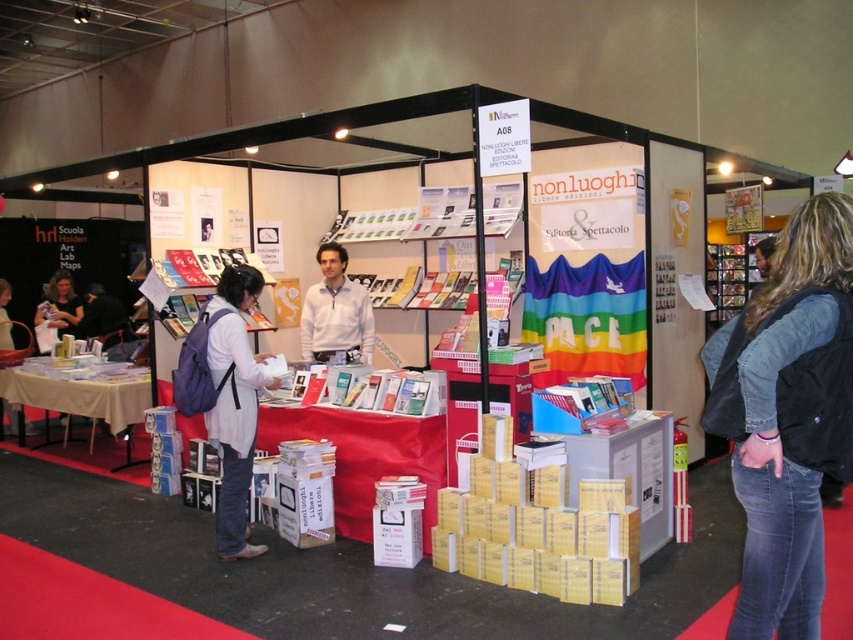
Which of these two, denim jacket at lower right or matte white sweater at lower left, stands taller?

Standing taller between the two is denim jacket at lower right.

Is denim jacket at lower right positioned before matte white sweater at lower left?

Yes, denim jacket at lower right is closer to the viewer.

Between point (746, 456) and point (62, 285), which one is positioned behind?

Point (62, 285)

I want to click on denim jacket at lower right, so click(787, 416).

Does white smooth shirt at center appear on the right side of matte gray sweater at center?

Yes, white smooth shirt at center is to the right of matte gray sweater at center.

Is point (363, 321) in front of point (1, 301)?

That is True.

Identify the location of white smooth shirt at center. (335, 310).

Is white smooth shirt at center to the right of matte white sweater at lower left from the viewer's perspective?

Indeed, white smooth shirt at center is positioned on the right side of matte white sweater at lower left.

Is point (328, 262) in front of point (79, 304)?

Yes, point (328, 262) is in front of point (79, 304).

Measure the distance between point [320,314] and camera.

Point [320,314] and camera are 5.84 meters apart from each other.

Identify the location of white smooth shirt at center. (335, 310).